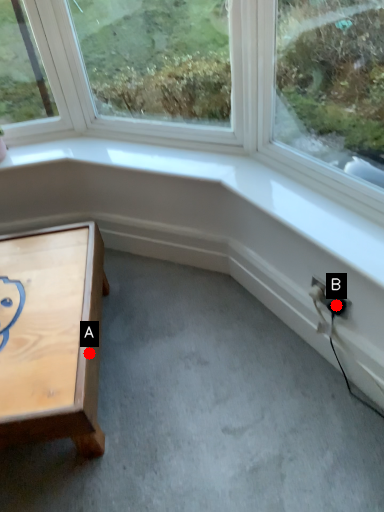
Question: Two points are circled on the image, labeled by A and B beside each circle. Which point is farther to the camera?

Choices:
 (A) A is further
 (B) B is further

Answer: (B)